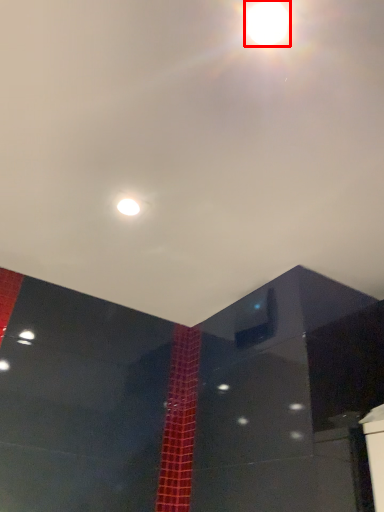
Question: Where is lamp (annotated by the red box) located in relation to light in the image?

Choices:
 (A) left
 (B) right

Answer: (B)